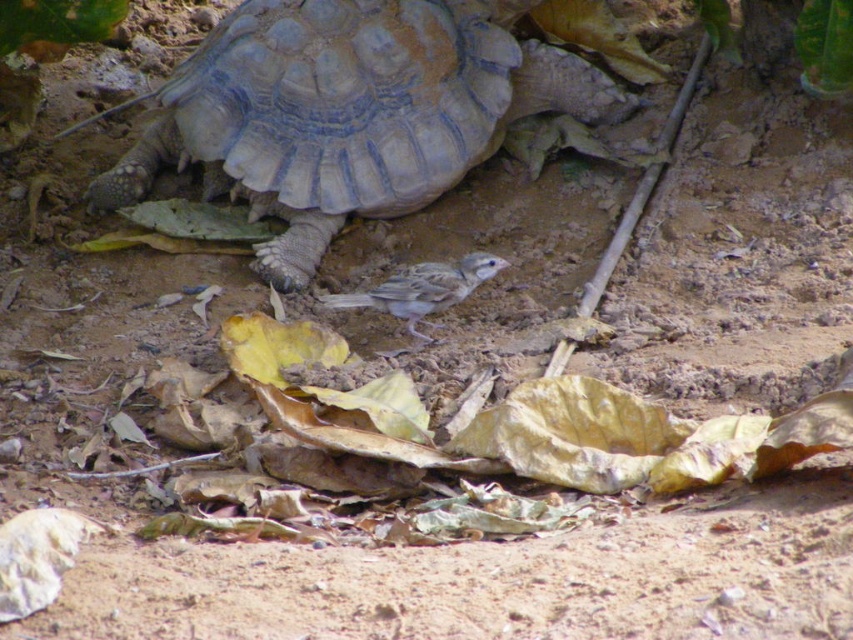
Does gray textured shell at center have a greater height compared to gray matte bird at center?

Correct, gray textured shell at center is much taller as gray matte bird at center.

Who is positioned more to the right, gray textured shell at center or gray matte bird at center?

gray matte bird at center

Is point (508, 52) positioned in front of point (453, 305)?

That is False.

Locate an element on the screen. gray textured shell at center is located at coordinates (329, 113).